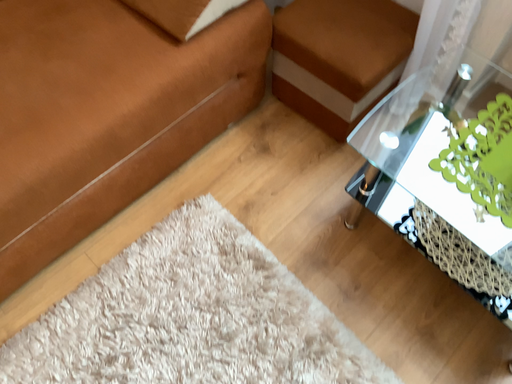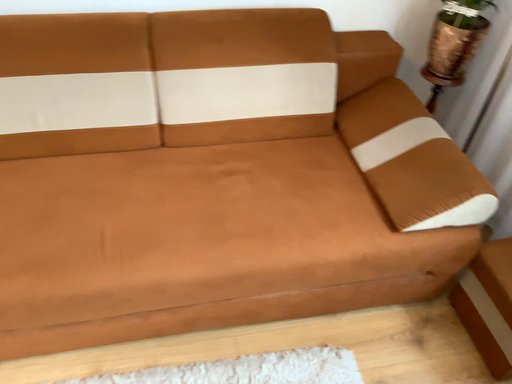
Question: How did the camera likely rotate when shooting the video?

Choices:
 (A) rotated right
 (B) rotated left

Answer: (B)